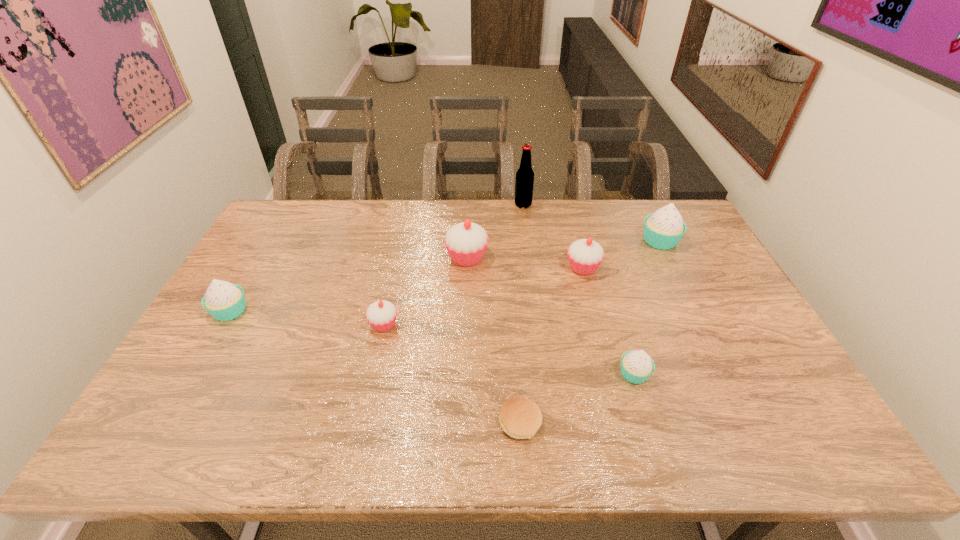
At what (x,y) coordinates should I click in order to perform the action: click on beer bottle. Please return your answer as a coordinate pair (x, y). Looking at the image, I should click on (524, 182).

Identify the location of the tallest object. The image size is (960, 540). (524, 182).

The width and height of the screenshot is (960, 540). I want to click on the fourth cupcake from right to left, so [x=466, y=242].

Where is `the second pink cupcake from right to left`? the second pink cupcake from right to left is located at coordinates (466, 242).

Identify the location of the rightmost object. The width and height of the screenshot is (960, 540). (663, 229).

At what (x,y) coordinates should I click in order to perform the action: click on the rightmost white cupcake. Please return your answer as a coordinate pair (x, y). The width and height of the screenshot is (960, 540). Looking at the image, I should click on (663, 229).

You are a GUI agent. You are given a task and a screenshot of the screen. Output one action in this format:
    pyautogui.click(x=<x>, y=<y>)
    Task: Click on the second nearest white cupcake
    
    Given the screenshot: What is the action you would take?
    pyautogui.click(x=224, y=301)

I want to click on the leftmost object, so click(224, 301).

Where is `the second biggest pink cupcake`? the second biggest pink cupcake is located at coordinates (585, 255).

The height and width of the screenshot is (540, 960). What are the coordinates of `the second cupcake from left to right` in the screenshot? It's located at click(381, 315).